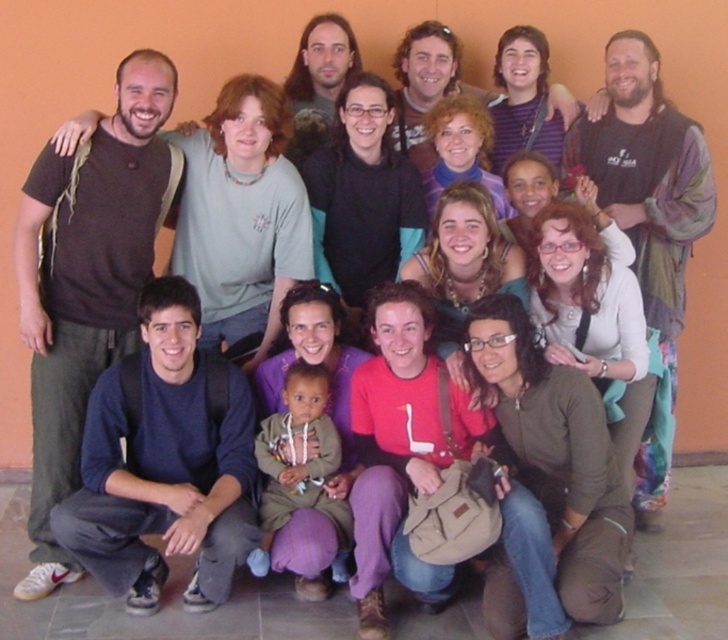
Question: Is brown matte t-shirt at left further to the viewer compared to black cotton vest at upper right?

Choices:
 (A) yes
 (B) no

Answer: (B)

Question: Which point is farther to the camera?

Choices:
 (A) black cotton vest at upper right
 (B) brown matte t-shirt at left

Answer: (A)

Question: Can you confirm if brown matte t-shirt at left is thinner than black cotton vest at upper right?

Choices:
 (A) no
 (B) yes

Answer: (A)

Question: Is brown matte t-shirt at left smaller than black cotton vest at upper right?

Choices:
 (A) no
 (B) yes

Answer: (A)

Question: Which point is closer to the camera?

Choices:
 (A) (132, 205)
 (B) (612, 147)

Answer: (A)